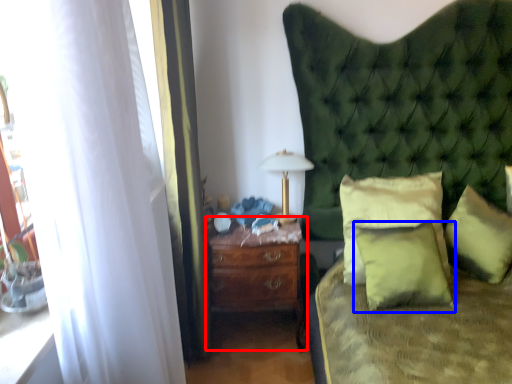
Question: Which of the following is the farthest to the observer, nightstand (highlighted by a red box) or pillow (highlighted by a blue box)?

Choices:
 (A) nightstand
 (B) pillow

Answer: (A)